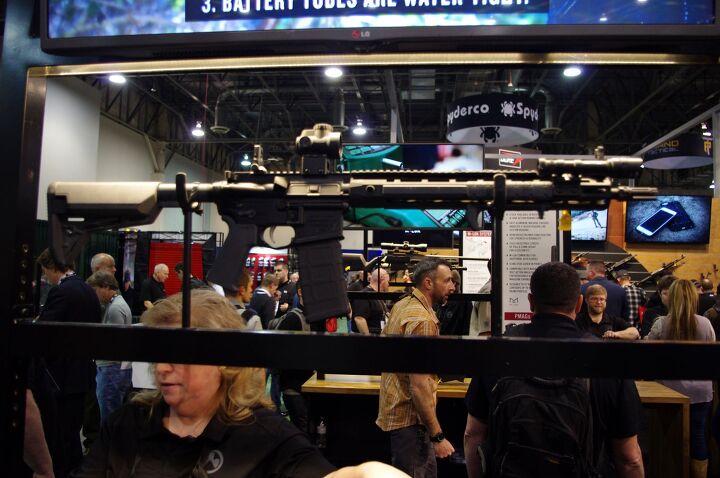
Find the location of a particular element. image of phone is located at coordinates (661, 215).